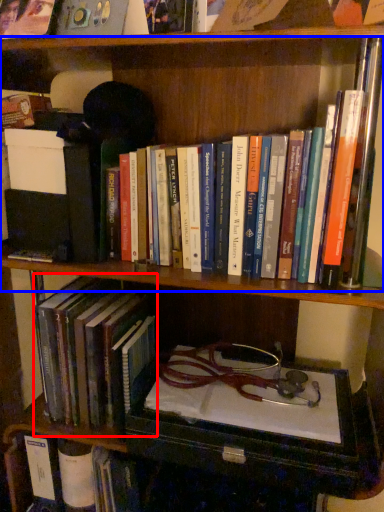
Question: Which object is further to the camera taking this photo, book (highlighted by a red box) or book (highlighted by a blue box)?

Choices:
 (A) book
 (B) book

Answer: (A)